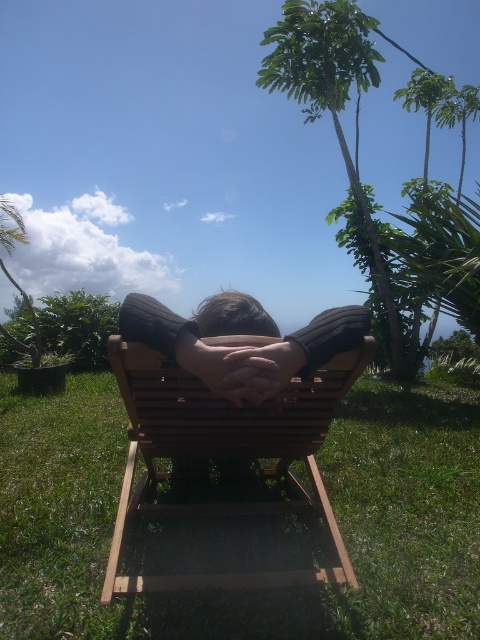
Is green grass at lower center wider than green leafy palm tree at upper right?

Correct, the width of green grass at lower center exceeds that of green leafy palm tree at upper right.

Does green grass at lower center appear on the left side of green leafy palm tree at upper right?

Indeed, green grass at lower center is positioned on the left side of green leafy palm tree at upper right.

Who is more forward, (417, 634) or (396, 362)?

Point (417, 634) is more forward.

The width and height of the screenshot is (480, 640). In order to click on green grass at lower center in this screenshot , I will do `click(248, 593)`.

Is point (58, 589) behind point (173, 428)?

No, (58, 589) is in front of (173, 428).

Is point (392, 554) positioned in front of point (208, 432)?

No, it is behind (208, 432).

This screenshot has height=640, width=480. What do you see at coordinates (248, 593) in the screenshot? I see `green grass at lower center` at bounding box center [248, 593].

The height and width of the screenshot is (640, 480). Identify the location of green grass at lower center. (248, 593).

Is point (149, 458) positioned before point (296, 342)?

No, (149, 458) is further to viewer.

Is wooden beach chair at center positioned behind dark brown sweater at center?

That is True.

At what (x,y) coordinates should I click in order to perform the action: click on wooden beach chair at center. Please return your answer as a coordinate pair (x, y). Looking at the image, I should click on (226, 452).